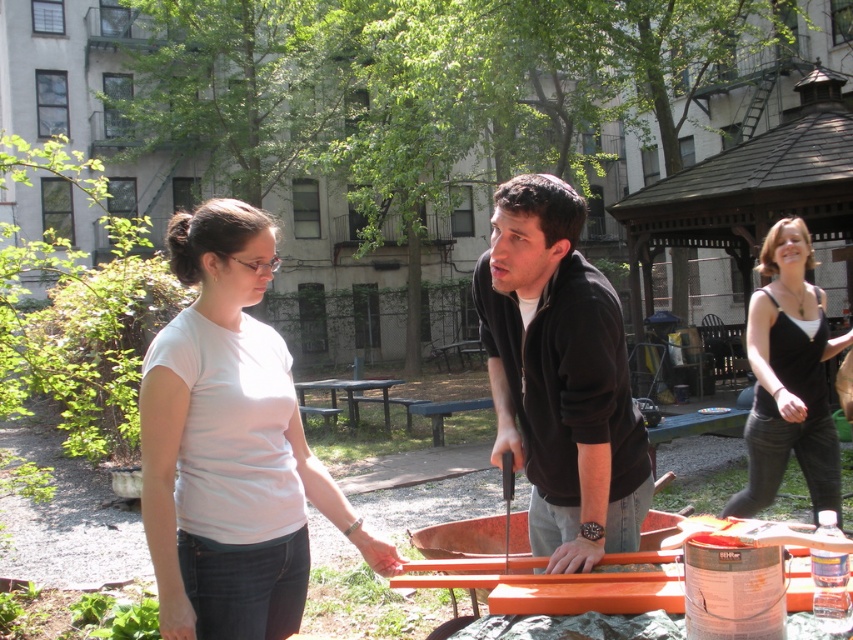
Question: Can you confirm if white matte t-shirt at center is bigger than black matte jacket at center?

Choices:
 (A) yes
 (B) no

Answer: (A)

Question: Estimate the real-world distances between objects in this image. Which object is closer to the white matte t-shirt at center?

Choices:
 (A) black tank top at right
 (B) black matte jacket at center

Answer: (B)

Question: Estimate the real-world distances between objects in this image. Which object is closer to the white matte t-shirt at center?

Choices:
 (A) black matte jacket at center
 (B) black tank top at right

Answer: (A)

Question: Can you confirm if black matte jacket at center is positioned to the right of black tank top at right?

Choices:
 (A) yes
 (B) no

Answer: (B)

Question: Among these points, which one is nearest to the camera?

Choices:
 (A) (792, 333)
 (B) (263, 499)
 (C) (496, 445)

Answer: (B)

Question: Does black matte jacket at center come in front of black tank top at right?

Choices:
 (A) yes
 (B) no

Answer: (A)